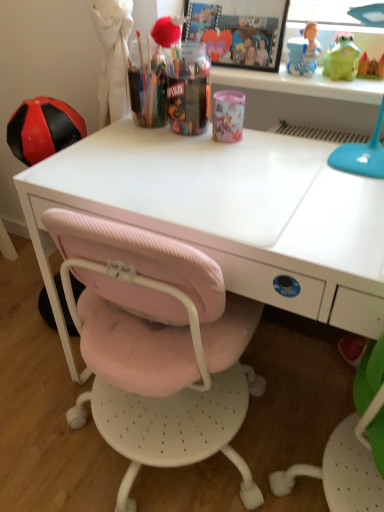
Question: Is matte green toy at upper right, arranged as the second toy when viewed from the left, situated inside white matte desk at center or outside?

Choices:
 (A) inside
 (B) outside

Answer: (B)

Question: From the image's perspective, relative to white matte desk at center, is matte green toy at upper right, which appears as the first toy when viewed from the right, above or below?

Choices:
 (A) below
 (B) above

Answer: (B)

Question: Considering the real-world distances, which object is farthest from the pink fabric chair at lower left?

Choices:
 (A) white matte desk at center
 (B) green rubber frog at upper right, arranged as the first toy when viewed from the left
 (C) matte green toy at upper right, which appears as the first toy when viewed from the right
 (D) translucent plastic container at center, the 2th stationery in the right-to-left sequence
 (E) pink glossy cup at center, which ranks as the 2th stationery in left-to-right order

Answer: (C)

Question: Estimate the real-world distances between objects in this image. Which object is farther from the translucent plastic container at center, the 2th stationery in the right-to-left sequence?

Choices:
 (A) pink fabric chair at lower left
 (B) green rubber frog at upper right, arranged as the first toy when viewed from the left
 (C) matte green toy at upper right, arranged as the second toy when viewed from the left
 (D) pink glossy cup at center, the 1th stationery positioned from the right
 (E) white matte desk at center

Answer: (A)